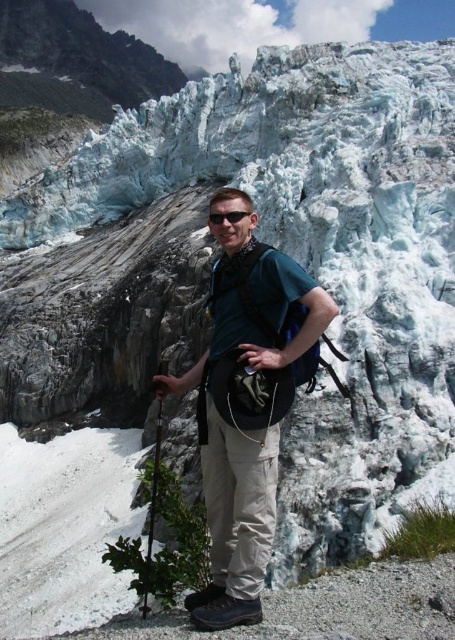
You are a hiker trying to reach your sunglasses that fell off while hiking near a glacier. You see your green fabric backpack at center and sunglasses at center in the image. Can you estimate how far your sunglasses are from your backpack?

The distance between the green fabric backpack at center and the sunglasses at center is 12.40 meters.

You are a hiker who wants to ensure your gear is properly arranged. You have a green fabric backpack at center and sunglasses at center. Which item takes up more horizontal space?

The green fabric backpack at center might be wider than sunglasses at center, so it likely takes up more horizontal space.

You are a photographer trying to capture the person in the scene. You want to focus on the sunglasses at center and the green fabric backpack at center. Which object is located to the right of the other?

The green fabric backpack at center is positioned on the right side of sunglasses at center, so the backpack is to the right of the sunglasses.